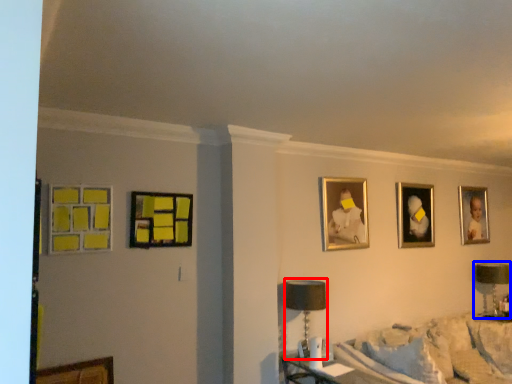
Question: Which of the following is the closest to the observer, table lamp (highlighted by a red box) or table lamp (highlighted by a blue box)?

Choices:
 (A) table lamp
 (B) table lamp

Answer: (A)